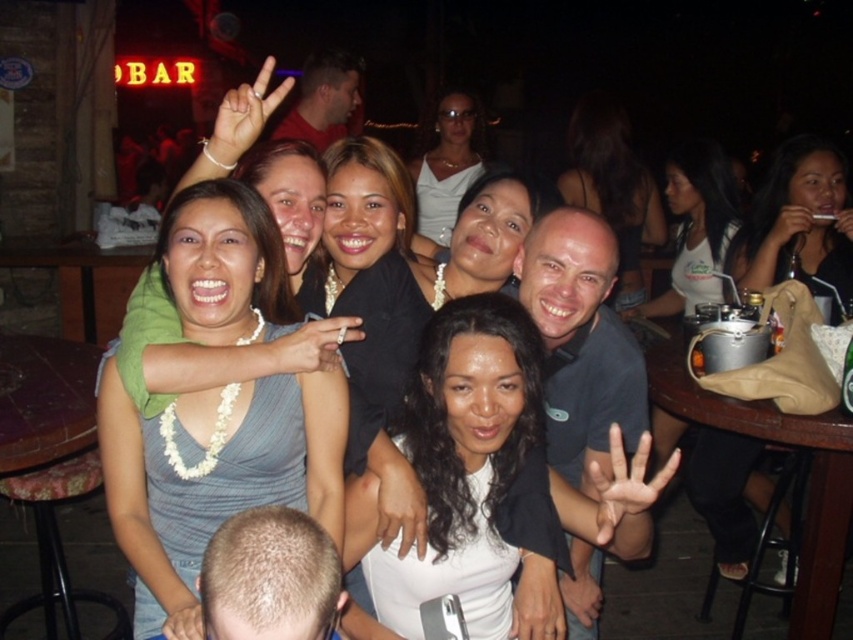
You are a photographer trying to capture a clear shot of the black hair at upper right and the matte black hair at center. Which of the two hair styles is located lower in the image?

The black hair at upper right is positioned under matte black hair at center, so the black hair at upper right is lower in the image.

You are a photographer trying to capture a closeup of the white beaded necklace at center and the bald head at center. Which object should you zoom in on to ensure both are in focus without adjusting the camera settings?

The white beaded necklace at center is larger in size than the bald head at center, so you should zoom in on the white beaded necklace at center to ensure both are in focus without adjusting the camera settings.